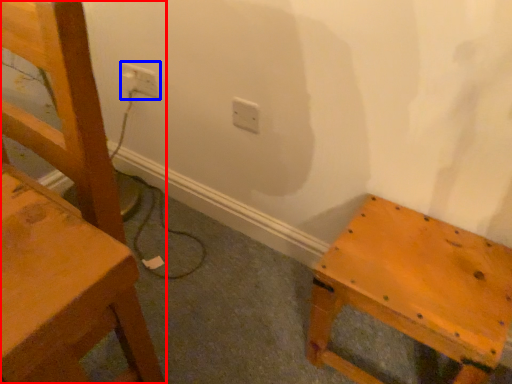
Question: Among these objects, which one is farthest to the camera, chair (highlighted by a red box) or electric outlet (highlighted by a blue box)?

Choices:
 (A) chair
 (B) electric outlet

Answer: (B)